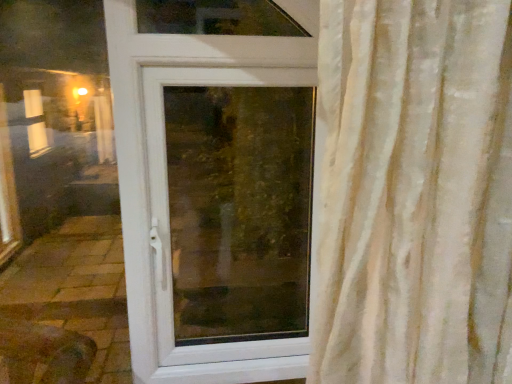
Locate an element on the screen. Image resolution: width=512 pixels, height=384 pixels. empty space that is ontop of transparent glass window at center (from a real-world perspective) is located at coordinates (236, 62).